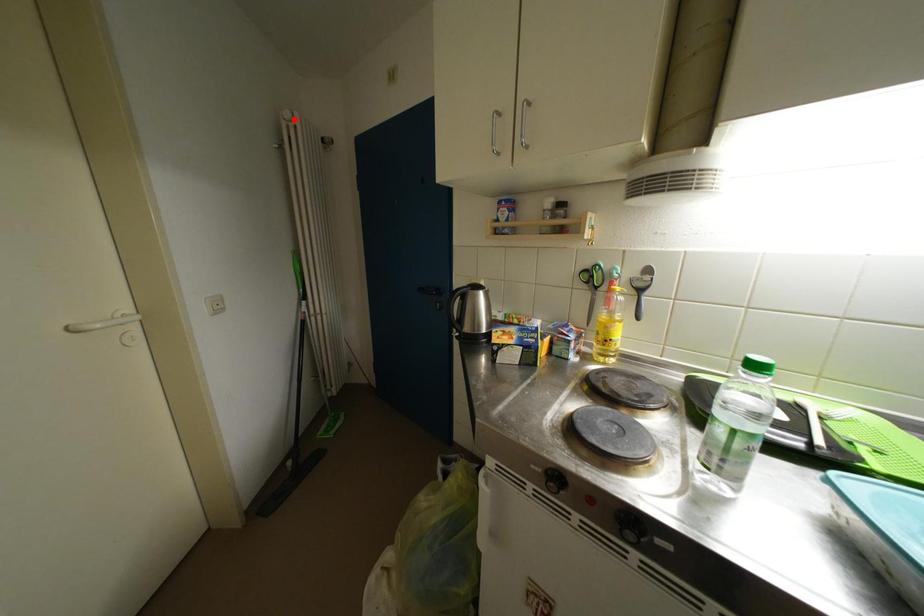
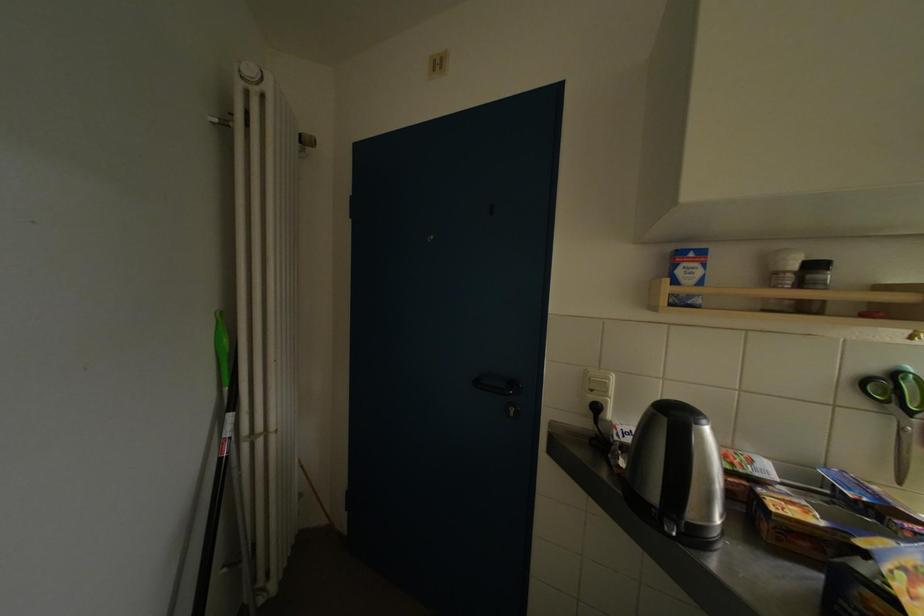
Locate, in the second image, the point that corresponds to the highlighted location in the first image.

(256, 75)